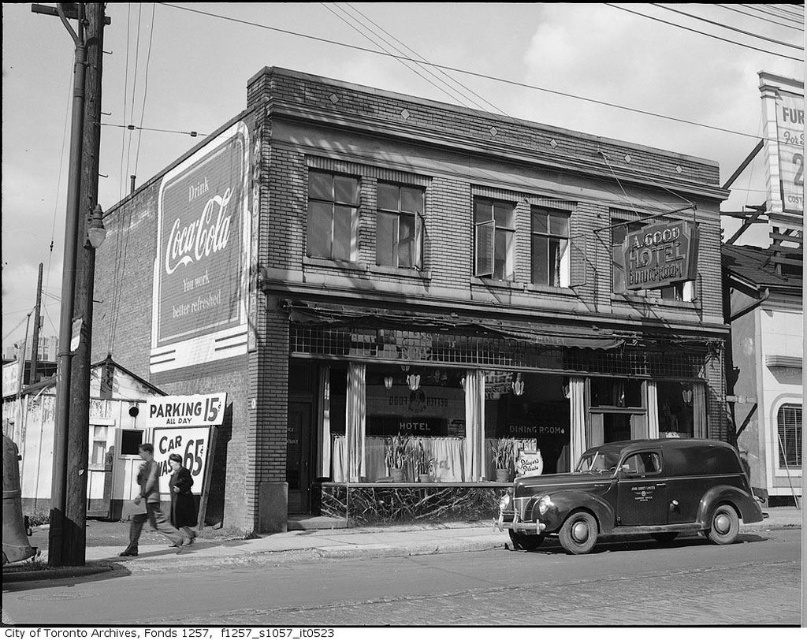
Question: Considering the relative positions of matte glass storefront at center and shiny black sedan at center in the image provided, where is matte glass storefront at center located with respect to shiny black sedan at center?

Choices:
 (A) right
 (B) left

Answer: (B)

Question: Which point is closer to the camera?

Choices:
 (A) (717, 513)
 (B) (458, 378)

Answer: (A)

Question: Does matte glass storefront at center have a lesser width compared to shiny black sedan at center?

Choices:
 (A) yes
 (B) no

Answer: (B)

Question: Which of the following is the closest to the observer?

Choices:
 (A) (717, 451)
 (B) (375, 385)

Answer: (A)

Question: Is matte glass storefront at center wider than shiny black sedan at center?

Choices:
 (A) yes
 (B) no

Answer: (A)